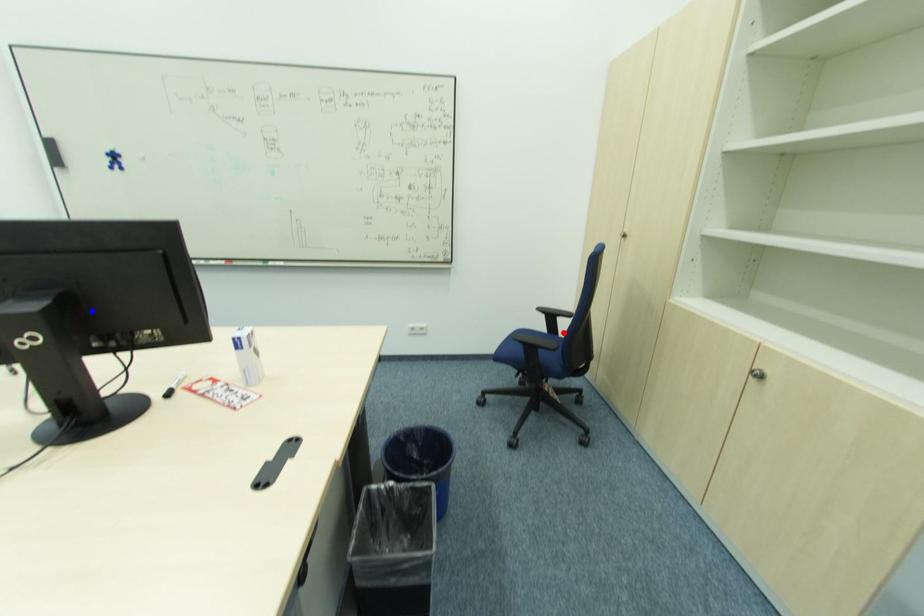
Question: Two points are marked on the image. Which point is closer to the camera?

Choices:
 (A) Blue point is closer.
 (B) Red point is closer.

Answer: (A)